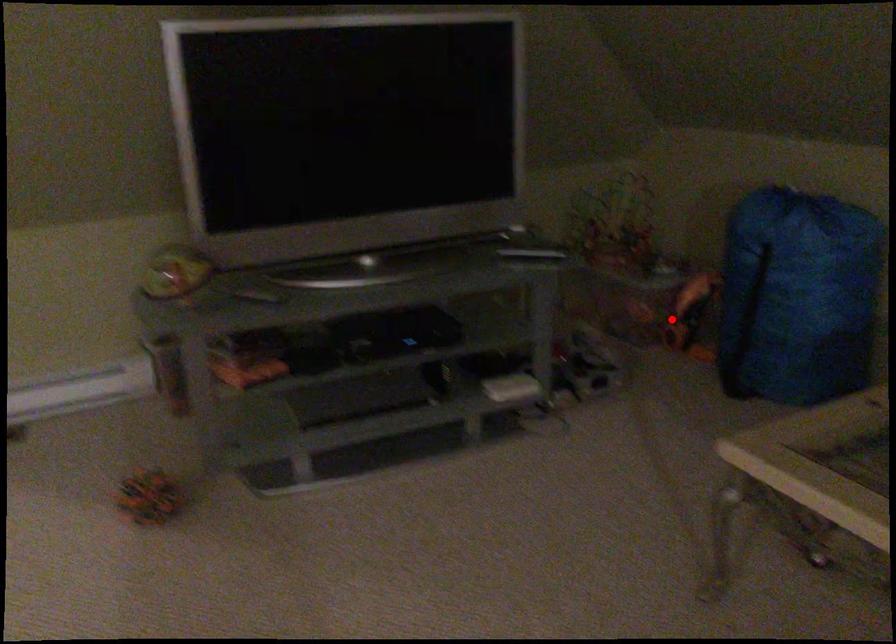
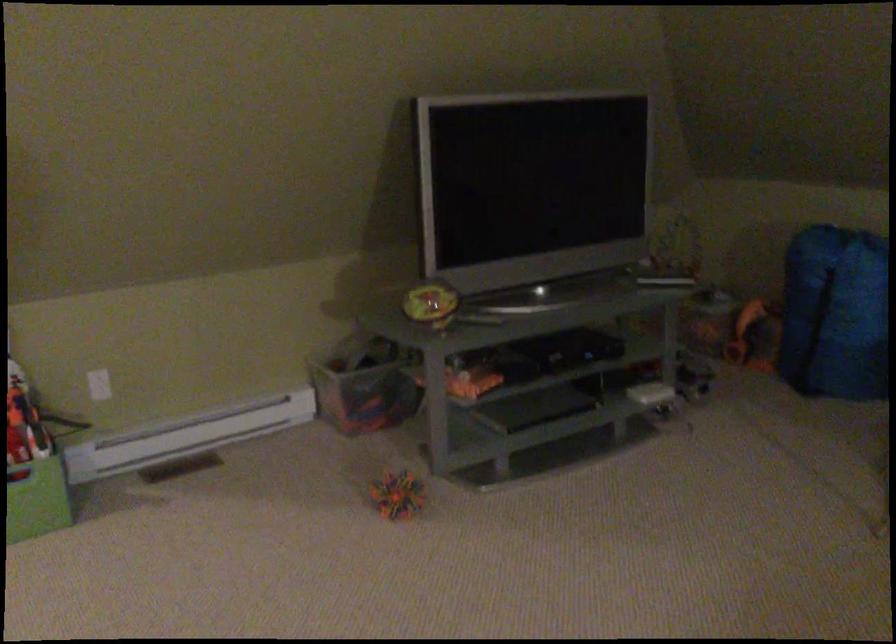
The point at the highlighted location is marked in the first image. Where is the corresponding point in the second image?

(754, 336)